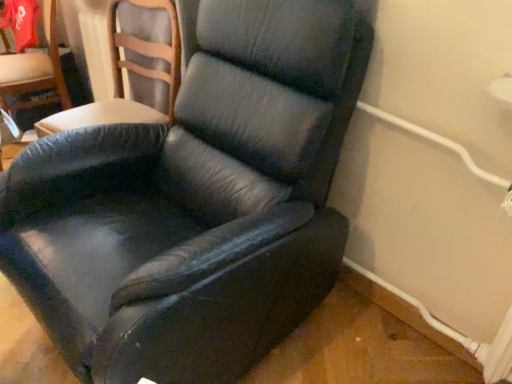
Question: In the image, is black leather chair at center, positioned as the 1th chair in right-to-left order, on the left side or the right side of black leather chair at center, the 2th chair viewed from the right?

Choices:
 (A) right
 (B) left

Answer: (A)

Question: Is black leather chair at center, which ranks as the 2th chair in left-to-right order, spatially inside black leather chair at center, acting as the 1th chair starting from the left, or outside of it?

Choices:
 (A) inside
 (B) outside

Answer: (B)

Question: In the image, is black leather chair at center, positioned as the 1th chair in right-to-left order, positioned in front of or behind black leather chair at center, the 2th chair viewed from the right?

Choices:
 (A) front
 (B) behind

Answer: (A)

Question: Which is correct: black leather chair at center, the 2th chair viewed from the right, is inside black leather chair at center, positioned as the 1th chair in right-to-left order, or outside of it?

Choices:
 (A) outside
 (B) inside

Answer: (A)

Question: Relative to black leather chair at center, positioned as the 1th chair in right-to-left order, is black leather chair at center, the 2th chair viewed from the right, in front or behind?

Choices:
 (A) behind
 (B) front

Answer: (A)

Question: Considering the positions of black leather chair at center, acting as the 1th chair starting from the left, and black leather chair at center, positioned as the 1th chair in right-to-left order, in the image, is black leather chair at center, acting as the 1th chair starting from the left, wider or thinner than black leather chair at center, positioned as the 1th chair in right-to-left order,?

Choices:
 (A) thin
 (B) wide

Answer: (A)

Question: Is point (169, 62) closer or farther from the camera than point (180, 147)?

Choices:
 (A) farther
 (B) closer

Answer: (A)